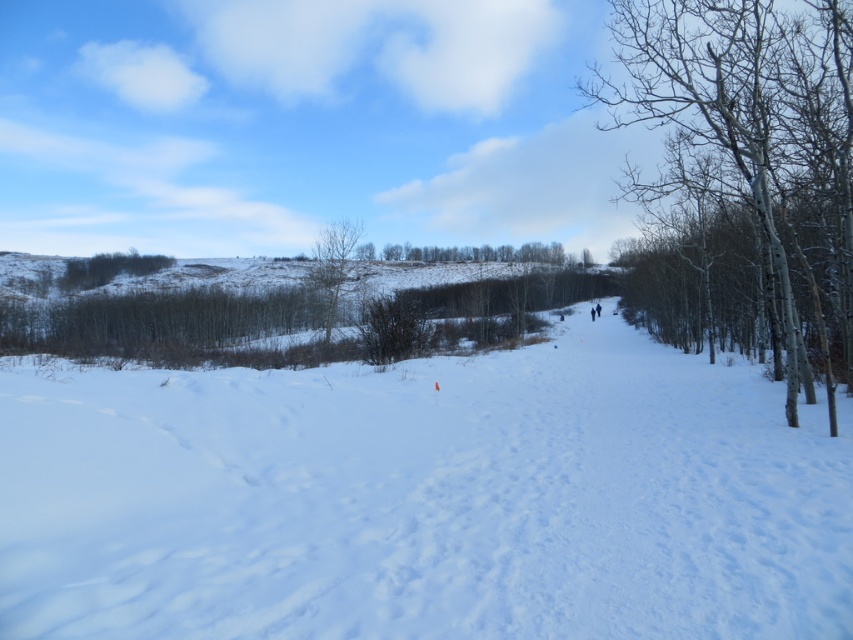
Between bare white tree at right and green leafless tree at center, which one appears on the right side from the viewer's perspective?

From the viewer's perspective, bare white tree at right appears more on the right side.

Can you confirm if bare white tree at right is taller than green leafless tree at center?

Yes, bare white tree at right is taller than green leafless tree at center.

You are a GUI agent. You are given a task and a screenshot of the screen. Output one action in this format:
    pyautogui.click(x=<x>, y=<y>)
    Task: Click on the bare white tree at right
    The width and height of the screenshot is (853, 640).
    Given the screenshot: What is the action you would take?
    pyautogui.click(x=704, y=102)

Can you confirm if bare branches at center is shorter than green leafless tree at center?

Incorrect, bare branches at center's height does not fall short of green leafless tree at center's.

Measure the distance between bare branches at center and green leafless tree at center.

bare branches at center is 21.27 meters away from green leafless tree at center.

Between point (357, 241) and point (537, 243), which one is positioned behind?

Point (537, 243)

Where is `bare branches at center`? This screenshot has width=853, height=640. bare branches at center is located at coordinates (334, 266).

Between point (786, 410) and point (323, 339), which one is positioned behind?

The point (323, 339) is more distant.

Which is more to the right, bare white tree at right or bare branches at center?

Positioned to the right is bare white tree at right.

Where is `bare white tree at right`? bare white tree at right is located at coordinates (704, 102).